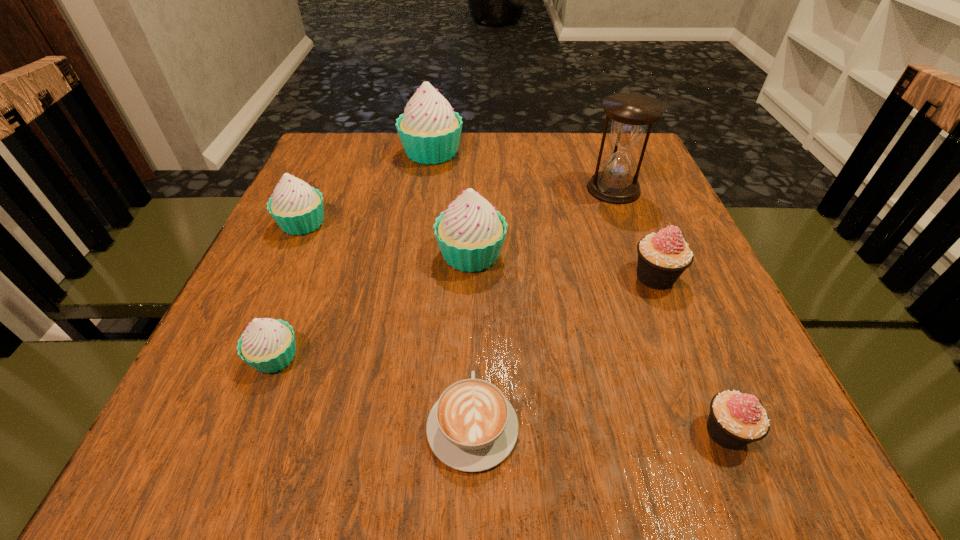
I want to click on free space between the second biggest white cupcake and the cappuccino, so click(x=471, y=340).

Find the location of a particular element. The height and width of the screenshot is (540, 960). vacant area that lies between the second smallest white cupcake and the nearest white cupcake is located at coordinates (289, 290).

Where is `vacant space that is in between the cappuccino and the nearest white cupcake`? The image size is (960, 540). vacant space that is in between the cappuccino and the nearest white cupcake is located at coordinates (373, 391).

At what (x,y) coordinates should I click in order to perform the action: click on free space between the shortest object and the fifth farthest cupcake. Please return your answer as a coordinate pair (x, y). The width and height of the screenshot is (960, 540). Looking at the image, I should click on 373,391.

Where is `free space between the farthest object and the farther pink cupcake`? The height and width of the screenshot is (540, 960). free space between the farthest object and the farther pink cupcake is located at coordinates (543, 215).

Locate which object ranks sixth in proximity to the cappuccino. Please provide its 2D coordinates. Your answer should be formatted as a tuple, i.e. [(x, y)], where the tuple contains the x and y coordinates of a point satisfying the conditions above.

[(631, 113)]

Where is `the closest object to the nearest cupcake`? the closest object to the nearest cupcake is located at coordinates (663, 257).

Identify the location of the third closest cupcake to the smaller pink cupcake. This screenshot has width=960, height=540. (268, 345).

Choose which cupcake is the third nearest neighbor to the nearer pink cupcake. Please provide its 2D coordinates. Your answer should be formatted as a tuple, i.e. [(x, y)], where the tuple contains the x and y coordinates of a point satisfying the conditions above.

[(268, 345)]

Locate an element on the screen. white cupcake that is the second closest to the farther pink cupcake is located at coordinates (430, 130).